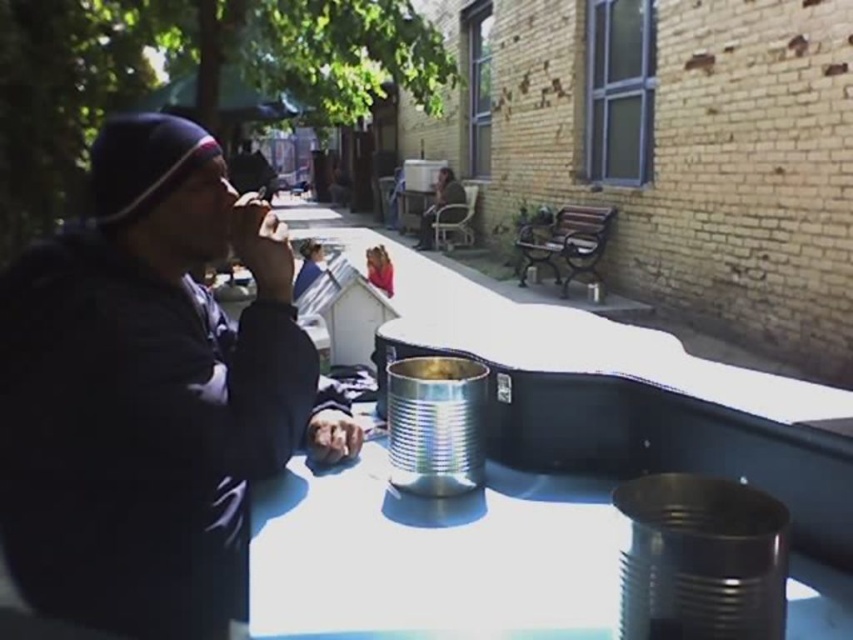
The width and height of the screenshot is (853, 640). I want to click on matte black jacket at left, so click(x=149, y=392).

Is matte black jacket at left bigger than dark brown leather jacket at center?

Actually, matte black jacket at left might be smaller than dark brown leather jacket at center.

This screenshot has height=640, width=853. In order to click on matte black jacket at left in this screenshot , I will do `click(149, 392)`.

Identify the location of matte black jacket at left. click(x=149, y=392).

Does point (253, 560) lie in front of point (439, 218)?

Yes, point (253, 560) is in front of point (439, 218).

Is point (589, 561) positioned before point (459, 205)?

That is True.

The height and width of the screenshot is (640, 853). Identify the location of metallic silver can at center. [x=431, y=556].

Is matte black jacket at left to the left of metallic silver can at center from the viewer's perspective?

Indeed, matte black jacket at left is positioned on the left side of metallic silver can at center.

Is point (250, 371) positioned after point (363, 496)?

That is False.

At what (x,y) coordinates should I click in order to perform the action: click on matte black jacket at left. Please return your answer as a coordinate pair (x, y). The height and width of the screenshot is (640, 853). Looking at the image, I should click on (149, 392).